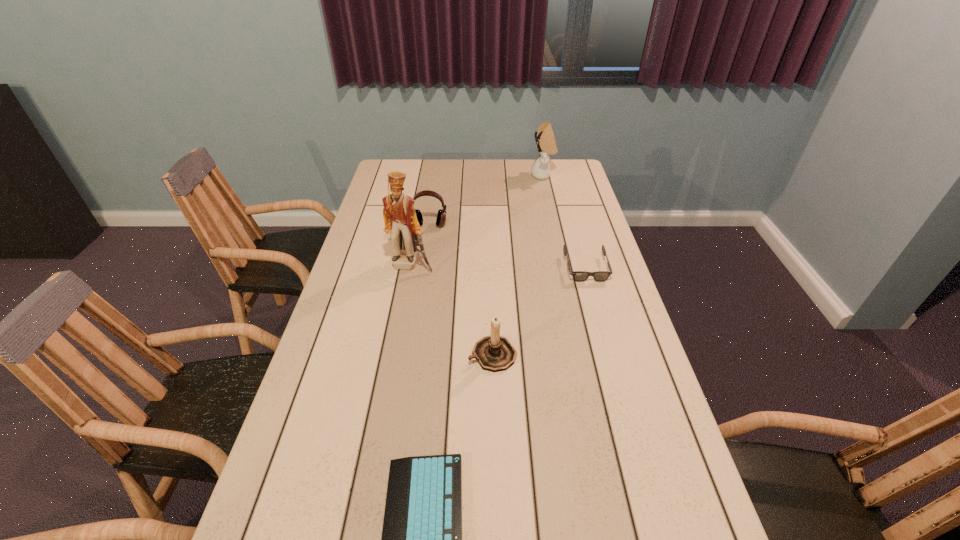
This screenshot has width=960, height=540. Find the location of `vacant space at the right edge`. vacant space at the right edge is located at coordinates (576, 238).

Image resolution: width=960 pixels, height=540 pixels. What are the coordinates of `free space at the far left corner of the desktop` in the screenshot? It's located at (405, 160).

I want to click on free space at the far right corner of the desktop, so click(580, 183).

The width and height of the screenshot is (960, 540). I want to click on free space between the headset and the candle holder, so click(x=461, y=290).

At what (x,y) coordinates should I click in order to perform the action: click on vacant space that's between the sunglasses and the headset. Please return your answer as a coordinate pair (x, y). This screenshot has width=960, height=540. Looking at the image, I should click on (508, 246).

The width and height of the screenshot is (960, 540). I want to click on vacant area that lies between the tallest object and the sunglasses, so click(x=498, y=266).

The width and height of the screenshot is (960, 540). I want to click on vacant space that is in between the second tallest object and the headset, so click(487, 200).

Where is `free point between the second nearest object and the fifth nearest object`? Image resolution: width=960 pixels, height=540 pixels. free point between the second nearest object and the fifth nearest object is located at coordinates (461, 290).

Image resolution: width=960 pixels, height=540 pixels. I want to click on the third closest object to the fifth tallest object, so click(x=400, y=219).

Locate an element on the screen. This screenshot has height=540, width=960. the third closest object relative to the tallest object is located at coordinates (579, 276).